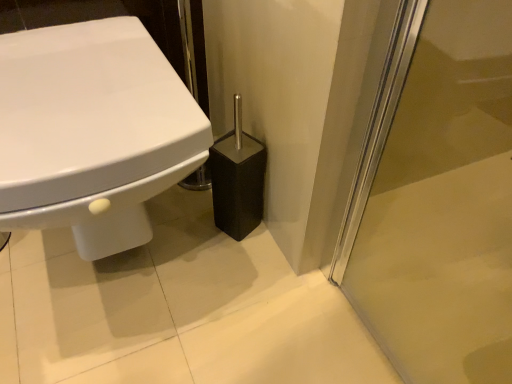
Find the location of a particular element. white glossy toilet at lower left is located at coordinates (92, 132).

Consider the image. What is the approximate height of white glossy toilet at lower left?

The height of white glossy toilet at lower left is 18.46 inches.

Image resolution: width=512 pixels, height=384 pixels. What do you see at coordinates (92, 132) in the screenshot? I see `white glossy toilet at lower left` at bounding box center [92, 132].

You are a GUI agent. You are given a task and a screenshot of the screen. Output one action in this format:
    pyautogui.click(x=<x>, y=<y>)
    Task: Click on the white glossy toilet at lower left
    Image resolution: width=512 pixels, height=384 pixels.
    Given the screenshot: What is the action you would take?
    pyautogui.click(x=92, y=132)